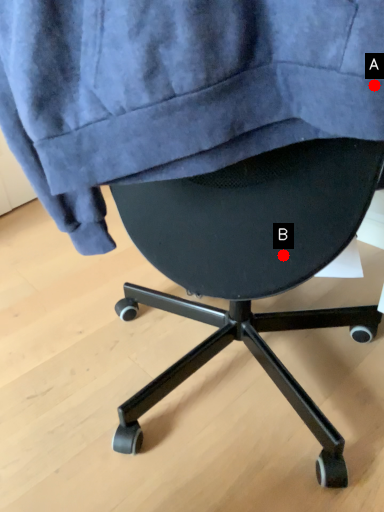
Question: Two points are circled on the image, labeled by A and B beside each circle. Which point is farther from the camera taking this photo?

Choices:
 (A) A is further
 (B) B is further

Answer: (B)